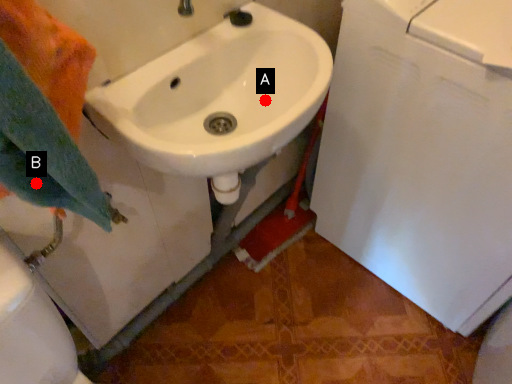
Question: Two points are circled on the image, labeled by A and B beside each circle. Which point appears farthest from the camera in this image?

Choices:
 (A) A is further
 (B) B is further

Answer: (A)